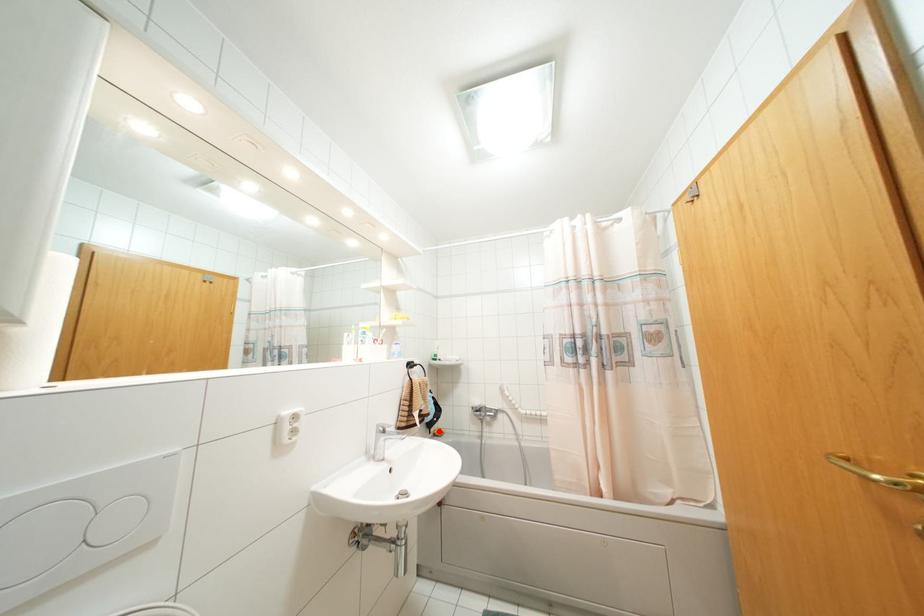
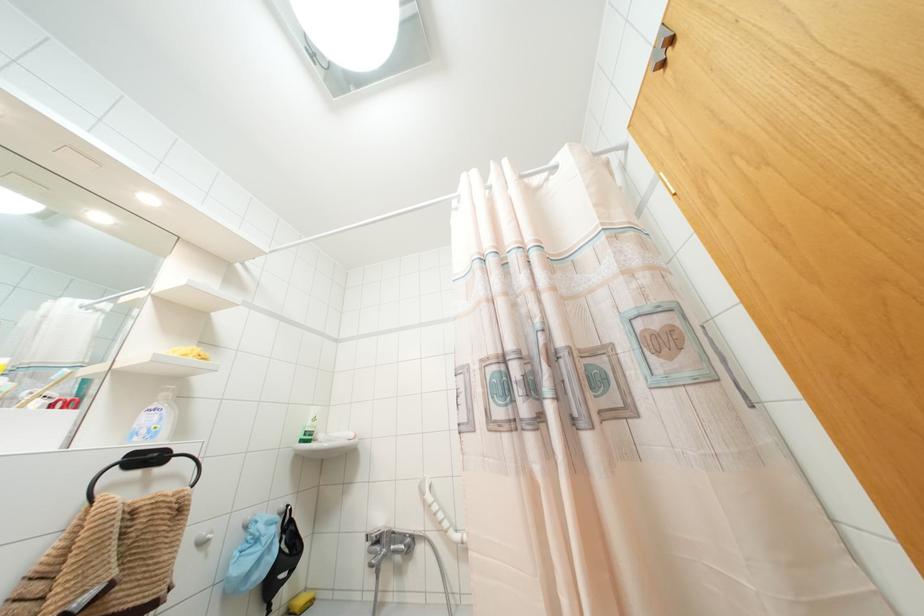
Where in the second image is the point corresponding to the highlighted location from the first image?

(299, 601)